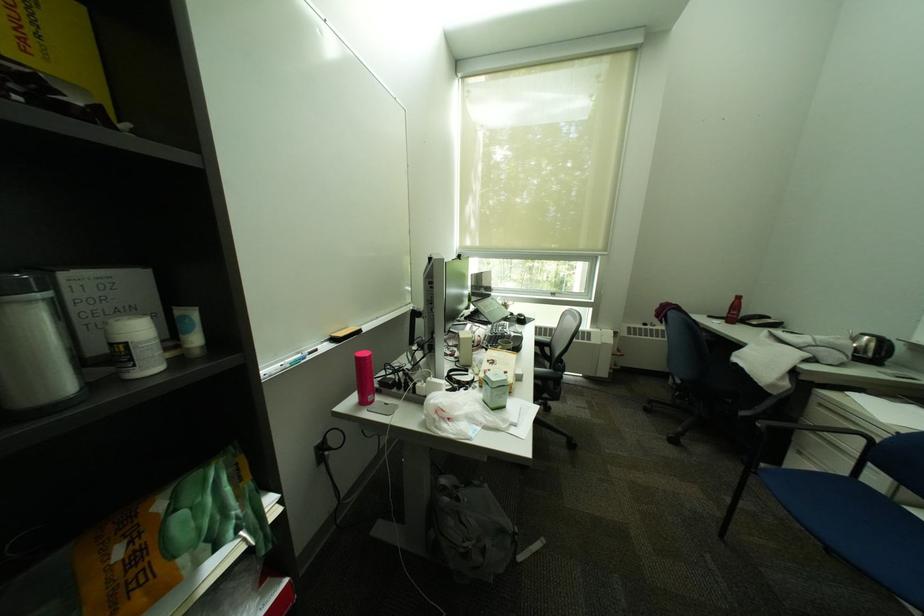
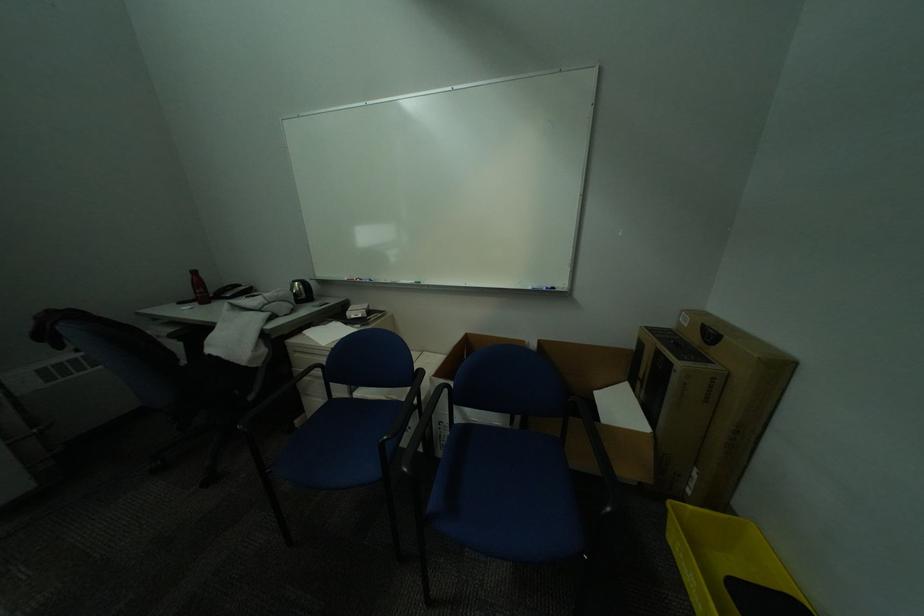
How did the camera likely rotate?

The rotation direction of the camera is right-down.